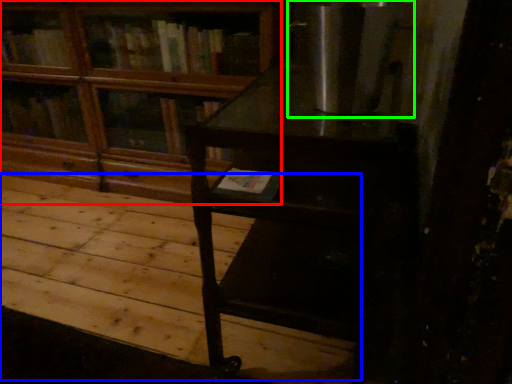
Question: Based on their relative distances, which object is nearer to bookcase (highlighted by a red box)? Choose from plywood (highlighted by a blue box) and appliance (highlighted by a green box).

Choices:
 (A) plywood
 (B) appliance

Answer: (A)